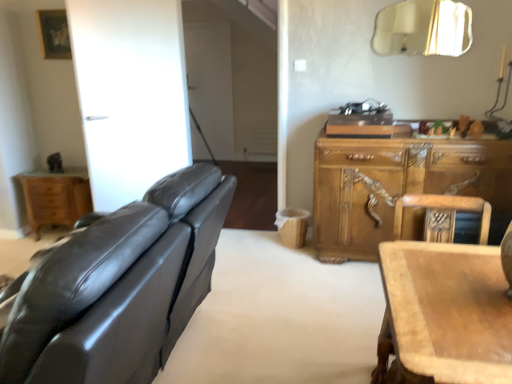
Question: Considering the positions of point (480, 190) and point (462, 8), is point (480, 190) closer or farther from the camera than point (462, 8)?

Choices:
 (A) closer
 (B) farther

Answer: (A)

Question: In the image, is wooden carved cabinet at right on the left side or the right side of gold metallic mirror at upper right?

Choices:
 (A) left
 (B) right

Answer: (A)

Question: Which is nearer to the wooden chair at right?

Choices:
 (A) gold metallic mirror at upper right
 (B) wooden carved cabinet at right
 (C) matte black leather couch at left
 (D) light brown wood nightstand at left

Answer: (B)

Question: Considering the real-world distances, which object is farthest from the matte black leather couch at left?

Choices:
 (A) wooden carved cabinet at right
 (B) gold metallic mirror at upper right
 (C) wooden chair at right
 (D) light brown wood nightstand at left

Answer: (B)